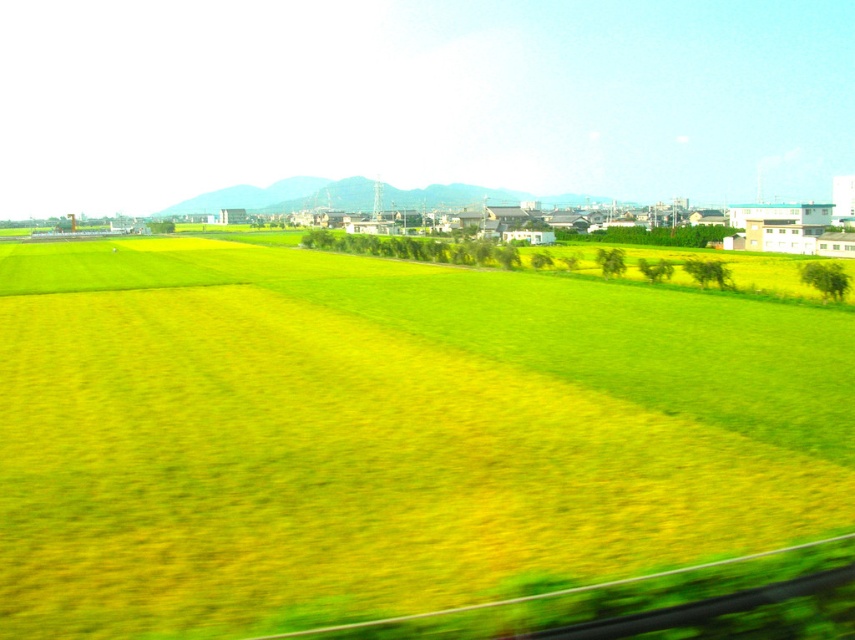
Question: Which of the following is the closest to the observer?

Choices:
 (A) (226, 192)
 (B) (292, 364)

Answer: (B)

Question: Is green grassy field at center to the left of green grassy hill at center from the viewer's perspective?

Choices:
 (A) yes
 (B) no

Answer: (B)

Question: Where is green grassy field at center located in relation to green grassy hill at center in the image?

Choices:
 (A) below
 (B) above

Answer: (A)

Question: Is green grassy field at center positioned before green grassy hill at center?

Choices:
 (A) yes
 (B) no

Answer: (A)

Question: Among these objects, which one is nearest to the camera?

Choices:
 (A) green grassy field at center
 (B) green grassy hill at center

Answer: (A)